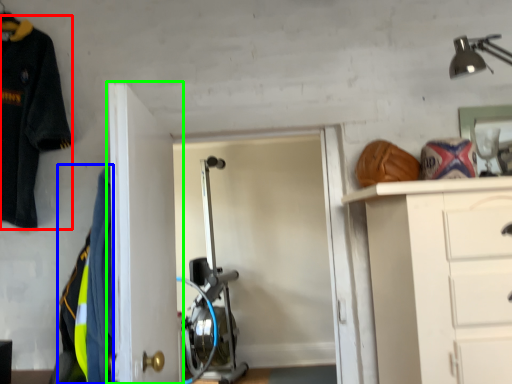
Question: Which object is the farthest from uniform (highlighted by a red box)? Choose among these: uniform (highlighted by a blue box) or door (highlighted by a green box).

Choices:
 (A) uniform
 (B) door

Answer: (A)